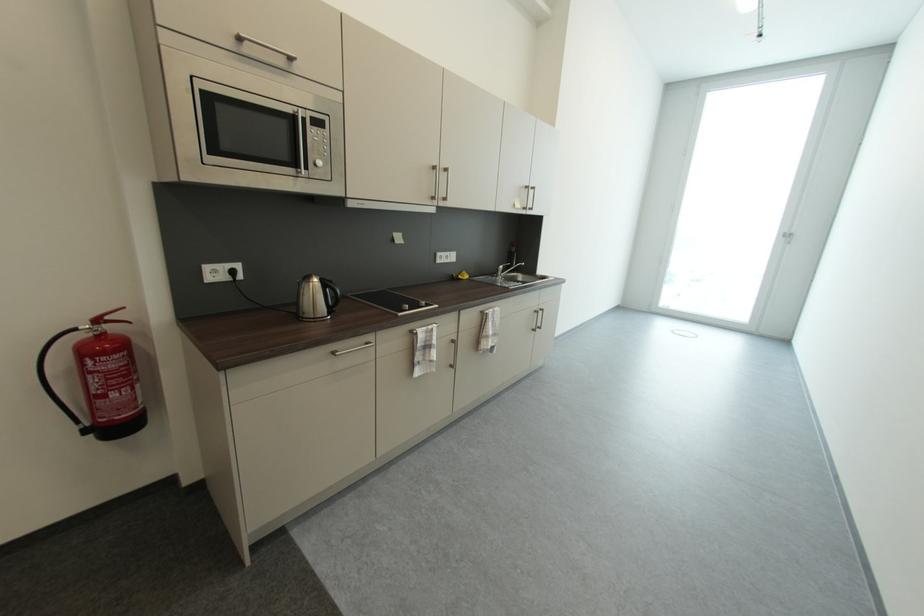
Where would you squeez the fire extinguisher lever? Please return your answer as a coordinate pair (x, y).

(106, 318)